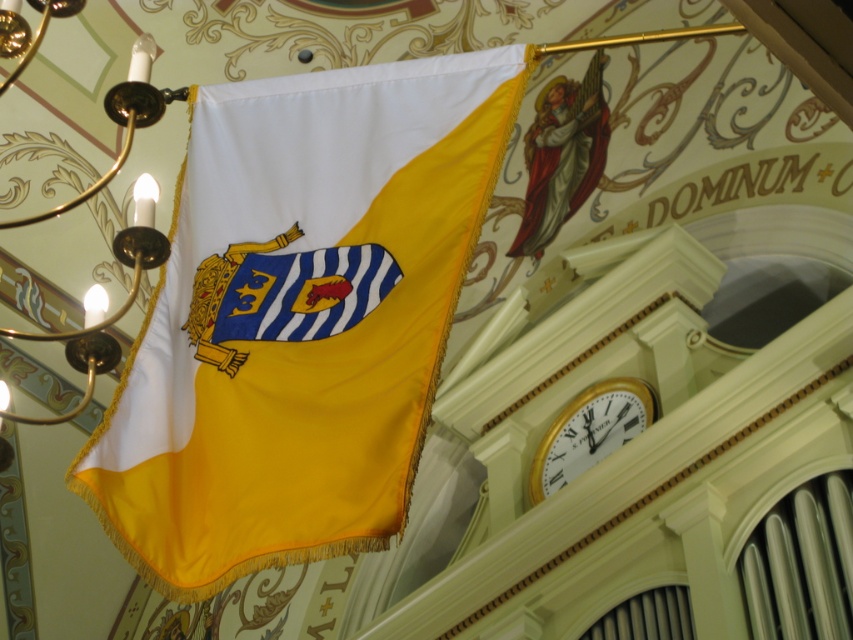
Question: Which of the following is the closest to the observer?

Choices:
 (A) (x=341, y=381)
 (B) (x=44, y=212)

Answer: (A)

Question: Is yellow satin flag at center closer to camera compared to gold-bronze chandelier at upper left?

Choices:
 (A) no
 (B) yes

Answer: (B)

Question: Does yellow satin flag at center lie behind white glossy clock at upper right?

Choices:
 (A) no
 (B) yes

Answer: (A)

Question: Which of the following is the farthest from the observer?

Choices:
 (A) (422, 291)
 (B) (105, 96)

Answer: (B)

Question: Which object appears closest to the camera in this image?

Choices:
 (A) gold-bronze chandelier at upper left
 (B) yellow satin flag at center

Answer: (B)

Question: Is yellow satin flag at center above gold-bronze chandelier at upper left?

Choices:
 (A) yes
 (B) no

Answer: (B)